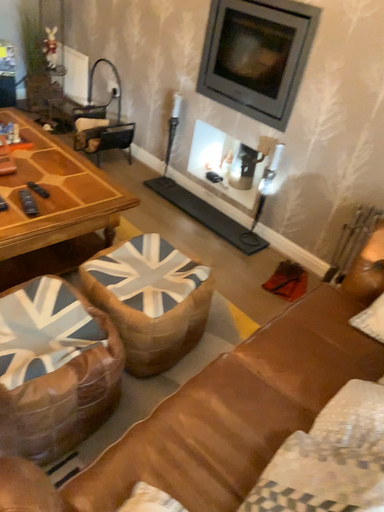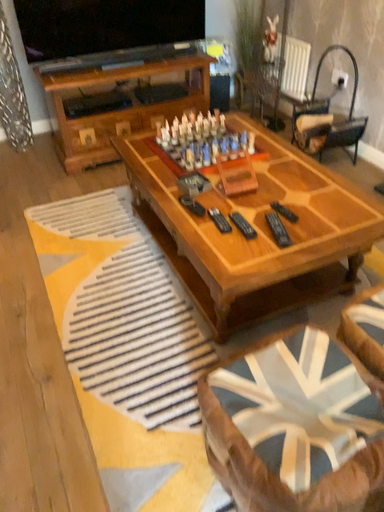
Question: Which way did the camera rotate in the video?

Choices:
 (A) rotated right
 (B) rotated left

Answer: (B)